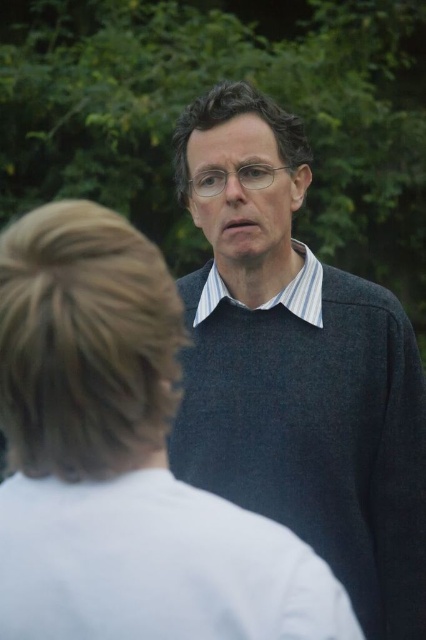
You are a fashion designer observing two people in a park. You notice the dark gray sweater at center and the striped cotton shirt at center. Which clothing item appears bigger in size?

The dark gray sweater at center is larger in size compared to the striped cotton shirt at center.

You are taking a photo of two people in a park. You notice the white matte shirt at center and the striped cotton shirt at center. Which shirt will appear larger in the photo?

The white matte shirt at center will appear larger in the photo because it is closer to the viewer than the striped cotton shirt at center.

From the picture: You are a photographer trying to capture a clear shot of both the white matte shirt at center and the striped cotton shirt at center. Since both are at the center, which one is closer to the camera?

The white matte shirt at center is located below the striped cotton shirt at center, so the striped cotton shirt at center is closer to the camera.